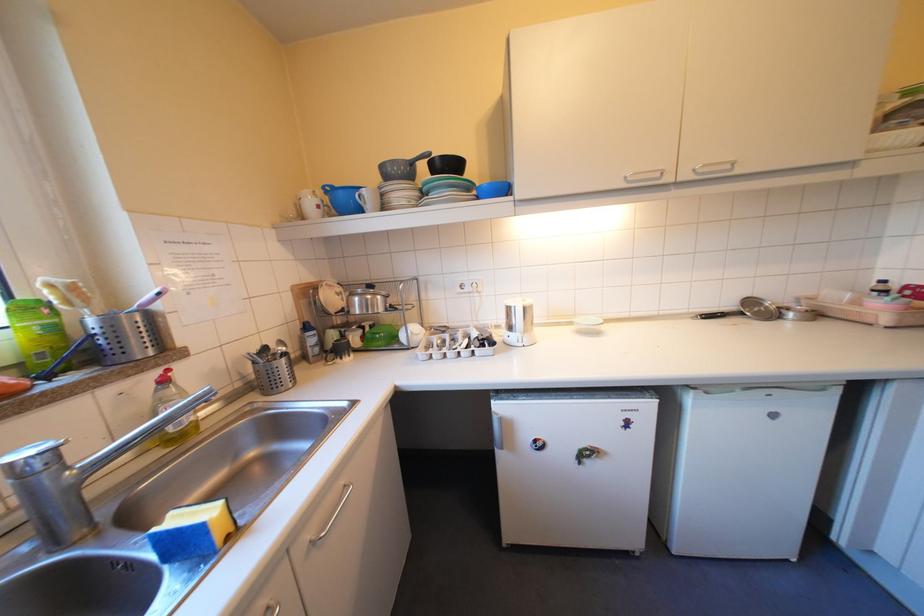
The location [82,586] corresponds to which object?

This point indicates the grey bowl.